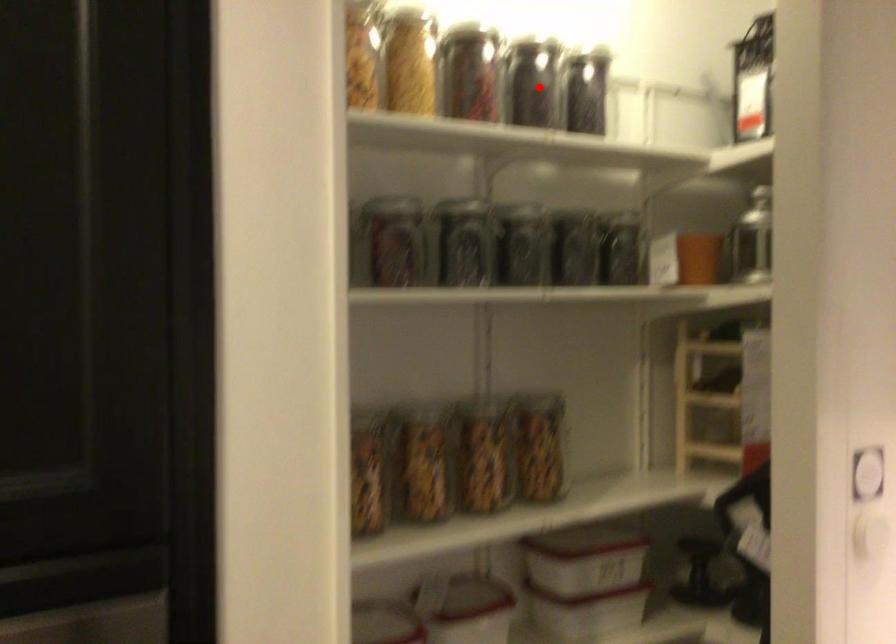
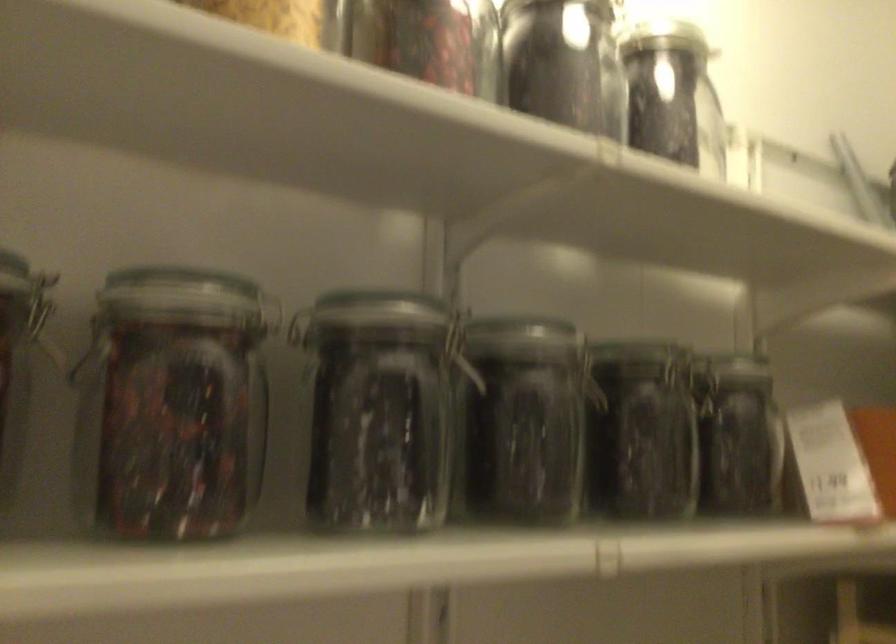
Question: I am providing you with two images of the same scene from different viewpoints. In image1, a red point is highlighted. Considering the same 3D point in image2, which of the following is correct?

Choices:
 (A) It is closer
 (B) It is farther

Answer: (A)